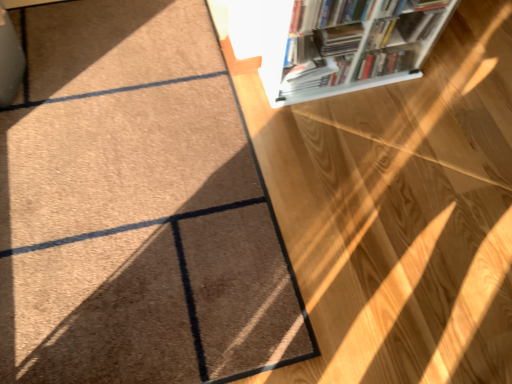
In order to face white plastic bookcase at upper right, should I rotate leftwards or rightwards?

Turn right by 13.161 degrees to look at white plastic bookcase at upper right.

Where is `white plastic bookcase at upper right`? white plastic bookcase at upper right is located at coordinates (346, 45).

Image resolution: width=512 pixels, height=384 pixels. What do you see at coordinates (346, 45) in the screenshot?
I see `white plastic bookcase at upper right` at bounding box center [346, 45].

Locate an element on the screen. brown carpet at upper left is located at coordinates (135, 207).

What do you see at coordinates (135, 207) in the screenshot?
I see `brown carpet at upper left` at bounding box center [135, 207].

You are a GUI agent. You are given a task and a screenshot of the screen. Output one action in this format:
    pyautogui.click(x=<x>, y=<y>)
    Task: Click on the white plastic bookcase at upper right
    This screenshot has width=512, height=384.
    Given the screenshot: What is the action you would take?
    pyautogui.click(x=346, y=45)

Is brown carpet at upper left at the right side of white plastic bookcase at upper right?

No, brown carpet at upper left is not to the right of white plastic bookcase at upper right.

Which object is closer to the camera taking this photo, brown carpet at upper left or white plastic bookcase at upper right?

brown carpet at upper left.

Is point (128, 22) farther from camera compared to point (313, 28)?

Yes.

In the scene shown: From the image's perspective, who appears lower, brown carpet at upper left or white plastic bookcase at upper right?

brown carpet at upper left is shown below in the image.

From a real-world perspective, is brown carpet at upper left physically located above or below white plastic bookcase at upper right?

From a real-world perspective, brown carpet at upper left is physically below white plastic bookcase at upper right.

Which of these two, brown carpet at upper left or white plastic bookcase at upper right, is thinner?

With smaller width is white plastic bookcase at upper right.

Which of these two, brown carpet at upper left or white plastic bookcase at upper right, stands taller?

With more height is white plastic bookcase at upper right.

Is brown carpet at upper left bigger than white plastic bookcase at upper right?

No.

Is brown carpet at upper left completely or partially outside of white plastic bookcase at upper right?

That's correct, brown carpet at upper left is outside of white plastic bookcase at upper right.

Can you see brown carpet at upper left touching white plastic bookcase at upper right?

No, brown carpet at upper left is not in contact with white plastic bookcase at upper right.

Could you tell me if brown carpet at upper left is turned towards white plastic bookcase at upper right?

No, brown carpet at upper left is not oriented towards white plastic bookcase at upper right.

Identify the location of bookcase behind the brown carpet at upper left. This screenshot has height=384, width=512. (346, 45).

Consider the image. Which is more to the right, white plastic bookcase at upper right or brown carpet at upper left?

From the viewer's perspective, white plastic bookcase at upper right appears more on the right side.

Is white plastic bookcase at upper right closer to camera compared to brown carpet at upper left?

No, white plastic bookcase at upper right is further to the viewer.

Does point (308, 27) appear closer or farther from the camera than point (78, 21)?

Clearly, point (308, 27) is closer to the camera than point (78, 21).

From the image's perspective, is white plastic bookcase at upper right above brown carpet at upper left?

Indeed, from the image's perspective, white plastic bookcase at upper right is shown above brown carpet at upper left.

From a real-world perspective, which is physically below, white plastic bookcase at upper right or brown carpet at upper left?

brown carpet at upper left.

Considering the sizes of objects white plastic bookcase at upper right and brown carpet at upper left in the image provided, who is wider, white plastic bookcase at upper right or brown carpet at upper left?

brown carpet at upper left is wider.

Between white plastic bookcase at upper right and brown carpet at upper left, which one has less height?

With less height is brown carpet at upper left.

Is white plastic bookcase at upper right bigger than brown carpet at upper left?

Yes.

Can we say white plastic bookcase at upper right lies outside brown carpet at upper left?

Absolutely, white plastic bookcase at upper right is external to brown carpet at upper left.

Based on the photo, are white plastic bookcase at upper right and brown carpet at upper left beside each other?

white plastic bookcase at upper right and brown carpet at upper left are clearly separated.

Is white plastic bookcase at upper right aimed at brown carpet at upper left?

No, white plastic bookcase at upper right does not turn towards brown carpet at upper left.

How many degrees apart are the facing directions of white plastic bookcase at upper right and brown carpet at upper left?

There is a 89.9-degree angle between the facing directions of white plastic bookcase at upper right and brown carpet at upper left.

Identify the location of bookcase lying behind the brown carpet at upper left. (346, 45).

You are a GUI agent. You are given a task and a screenshot of the screen. Output one action in this format:
    pyautogui.click(x=<x>, y=<y>)
    Task: Click on the bookcase positioned vertically above the brown carpet at upper left (from a real-world perspective)
    This screenshot has width=512, height=384.
    Given the screenshot: What is the action you would take?
    pyautogui.click(x=346, y=45)

Image resolution: width=512 pixels, height=384 pixels. I want to click on doormat that is in front of the white plastic bookcase at upper right, so click(135, 207).